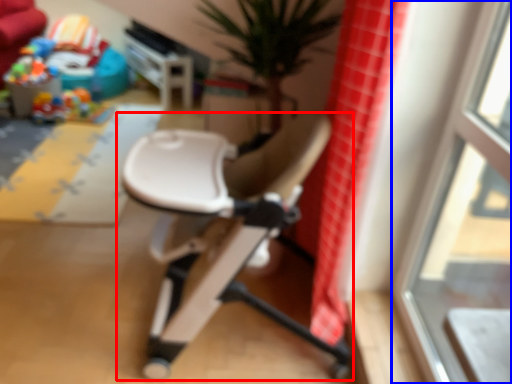
Question: Which object appears farthest to the camera in this image, chair (highlighted by a red box) or window (highlighted by a blue box)?

Choices:
 (A) chair
 (B) window

Answer: (A)